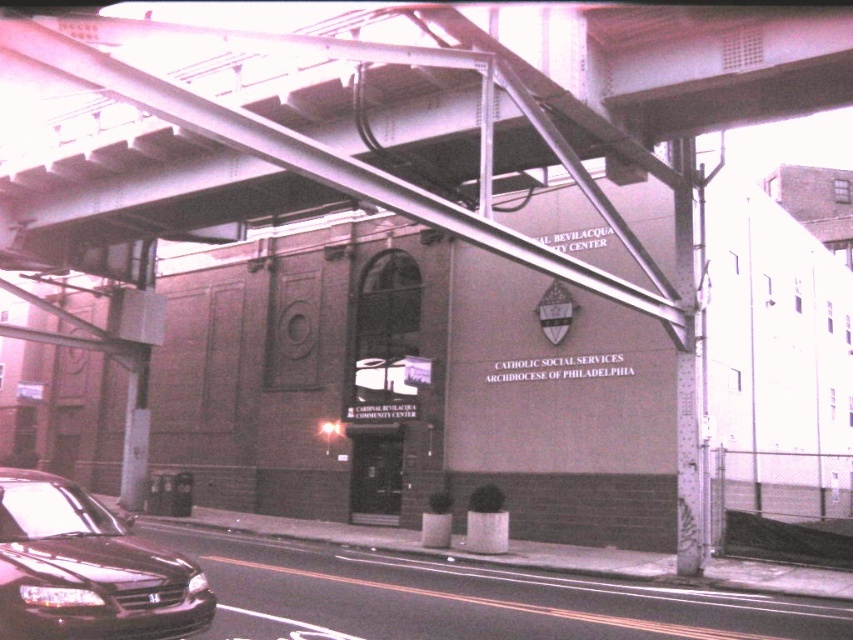
Question: Does metal at upper center lie in front of shiny black sedan at lower left?

Choices:
 (A) no
 (B) yes

Answer: (A)

Question: Is metal at upper center positioned at the back of shiny black sedan at lower left?

Choices:
 (A) no
 (B) yes

Answer: (B)

Question: Can you confirm if metal at upper center is wider than shiny black sedan at lower left?

Choices:
 (A) yes
 (B) no

Answer: (A)

Question: Which object is closer to the camera taking this photo?

Choices:
 (A) metal at upper center
 (B) shiny black sedan at lower left

Answer: (B)

Question: Which point is closer to the camera?

Choices:
 (A) (585, 125)
 (B) (44, 618)

Answer: (B)

Question: Among these objects, which one is farthest from the camera?

Choices:
 (A) metal at upper center
 (B) shiny black sedan at lower left

Answer: (A)